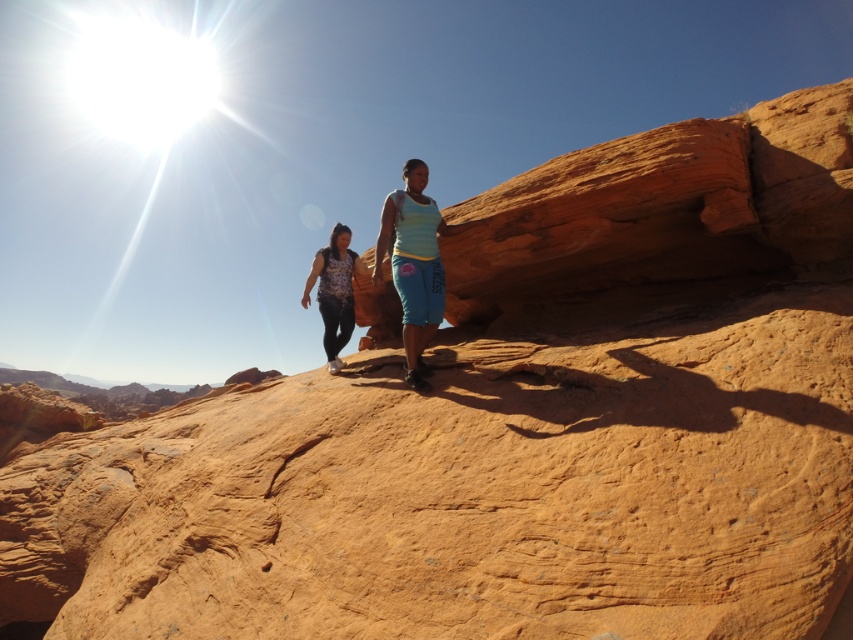
Question: Does light blue denim shorts at center appear on the left side of matte floral shirt at center?

Choices:
 (A) yes
 (B) no

Answer: (B)

Question: Which point is closer to the camera?

Choices:
 (A) (341, 337)
 (B) (383, 211)

Answer: (B)

Question: Does light blue denim shorts at center appear over matte floral shirt at center?

Choices:
 (A) yes
 (B) no

Answer: (A)

Question: Is the position of light blue denim shorts at center less distant than that of matte floral shirt at center?

Choices:
 (A) yes
 (B) no

Answer: (A)